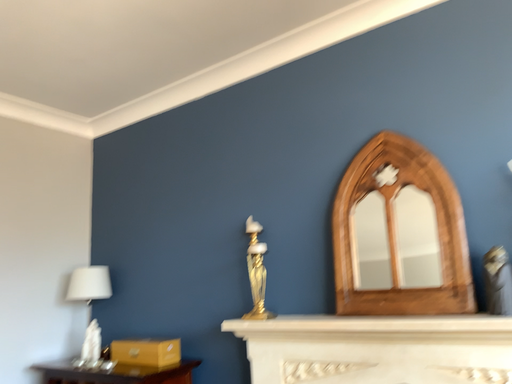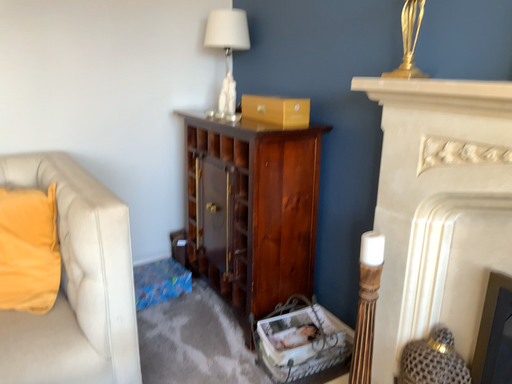
Question: How did the camera likely rotate when shooting the video?

Choices:
 (A) rotated upward
 (B) rotated downward

Answer: (B)